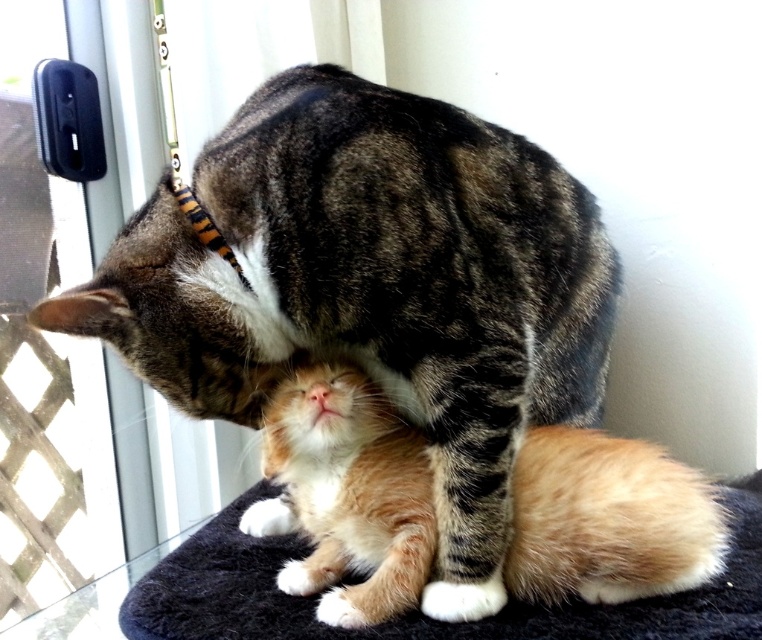
Does orange fur kitten at center have a lesser height compared to black fuzzy mat at lower center?

No, orange fur kitten at center is not shorter than black fuzzy mat at lower center.

Is orange fur kitten at center bigger than black fuzzy mat at lower center?

Yes, orange fur kitten at center is bigger than black fuzzy mat at lower center.

Who is more distant from viewer, (530,509) or (748,589)?

The point (748,589) is more distant.

I want to click on orange fur kitten at center, so tap(346, 496).

Can you confirm if tabby fur cat at center is positioned to the right of black fuzzy mat at lower center?

Incorrect, tabby fur cat at center is not on the right side of black fuzzy mat at lower center.

Is tabby fur cat at center to the left of black fuzzy mat at lower center from the viewer's perspective?

Yes, tabby fur cat at center is to the left of black fuzzy mat at lower center.

Does point (487, 205) come in front of point (271, 595)?

No, it is behind (271, 595).

You are a GUI agent. You are given a task and a screenshot of the screen. Output one action in this format:
    pyautogui.click(x=<x>, y=<y>)
    Task: Click on the tabby fur cat at center
    
    Given the screenshot: What is the action you would take?
    [373, 288]

Between orange fur kitten at center and orange and black striped fabric at upper center, which one appears on the right side from the viewer's perspective?

From the viewer's perspective, orange fur kitten at center appears more on the right side.

What do you see at coordinates (346, 496) in the screenshot? I see `orange fur kitten at center` at bounding box center [346, 496].

The height and width of the screenshot is (640, 762). Find the location of `orange fur kitten at center`. orange fur kitten at center is located at coordinates (346, 496).